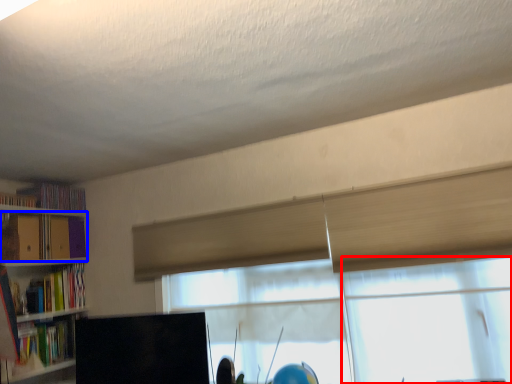
Question: Which point is closer to the camera, glass door (highlighted by a red box) or book (highlighted by a blue box)?

Choices:
 (A) glass door
 (B) book

Answer: (A)